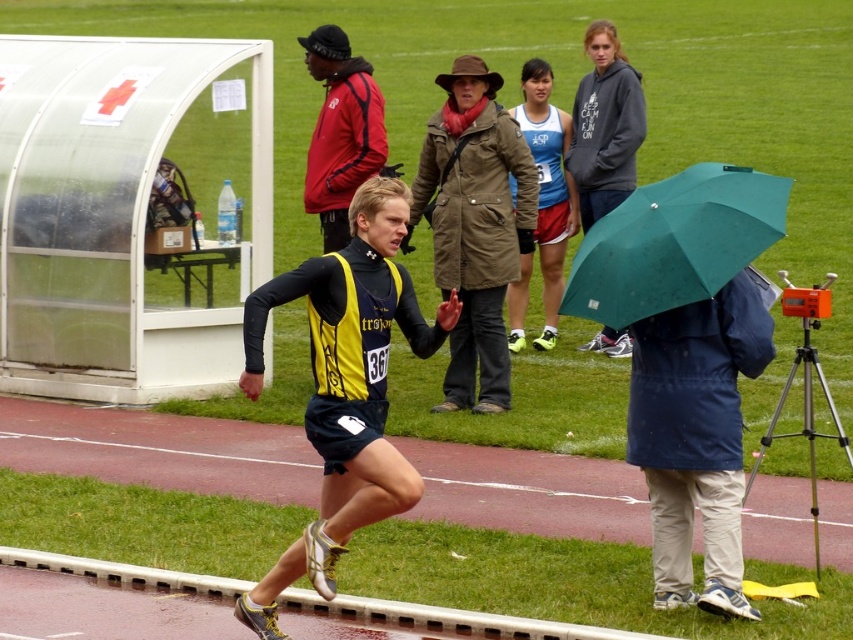
Between matte black jacket at upper left and blue fabric shorts at center, which one appears on the left side from the viewer's perspective?

matte black jacket at upper left is more to the left.

Between matte black jacket at upper left and blue fabric shorts at center, which one appears on the right side from the viewer's perspective?

From the viewer's perspective, blue fabric shorts at center appears more on the right side.

Is point (355, 115) behind point (555, 227)?

That is False.

Locate an element on the screen. matte black jacket at upper left is located at coordinates (340, 131).

Is dark gray hoodie at upper center closer to camera compared to blue fabric shorts at center?

No.

Who is taller, dark gray hoodie at upper center or blue fabric shorts at center?

With more height is blue fabric shorts at center.

Is point (630, 156) positioned after point (573, 230)?

No, (630, 156) is closer to viewer.

Locate an element on the screen. dark gray hoodie at upper center is located at coordinates tap(605, 125).

Is yellow/black athletic top at center shorter than dark gray hoodie at upper center?

In fact, yellow/black athletic top at center may be taller than dark gray hoodie at upper center.

Is yellow/black athletic top at center bigger than dark gray hoodie at upper center?

Correct, yellow/black athletic top at center is larger in size than dark gray hoodie at upper center.

Is point (355, 356) closer to camera compared to point (637, 97)?

Yes, it is.

You are a GUI agent. You are given a task and a screenshot of the screen. Output one action in this format:
    pyautogui.click(x=<x>, y=<y>)
    Task: Click on the yellow/black athletic top at center
    Image resolution: width=853 pixels, height=640 pixels.
    Given the screenshot: What is the action you would take?
    pyautogui.click(x=345, y=387)